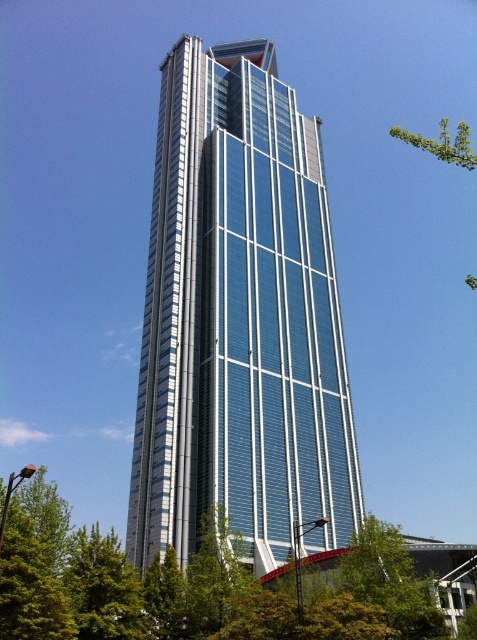
Question: Which of the following is the farthest from the observer?

Choices:
 (A) (210, 548)
 (B) (257, 333)

Answer: (B)

Question: Can you confirm if shiny glass tower at center is positioned to the left of green leafy tree at lower left?

Choices:
 (A) yes
 (B) no

Answer: (B)

Question: Is shiny glass tower at center positioned behind green leafy tree at lower left?

Choices:
 (A) no
 (B) yes

Answer: (B)

Question: Does shiny glass tower at center lie in front of green leafy tree at lower left?

Choices:
 (A) no
 (B) yes

Answer: (A)